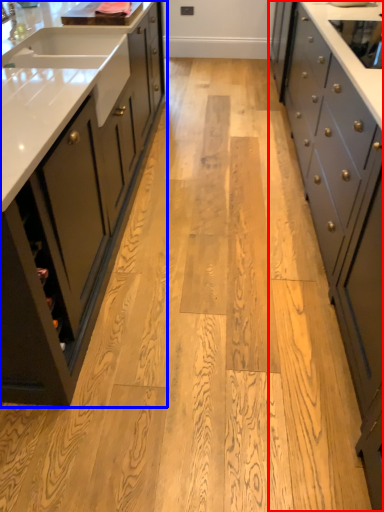
Question: Which point is further to the camera, cabinetry (highlighted by a red box) or cabinetry (highlighted by a blue box)?

Choices:
 (A) cabinetry
 (B) cabinetry

Answer: (B)